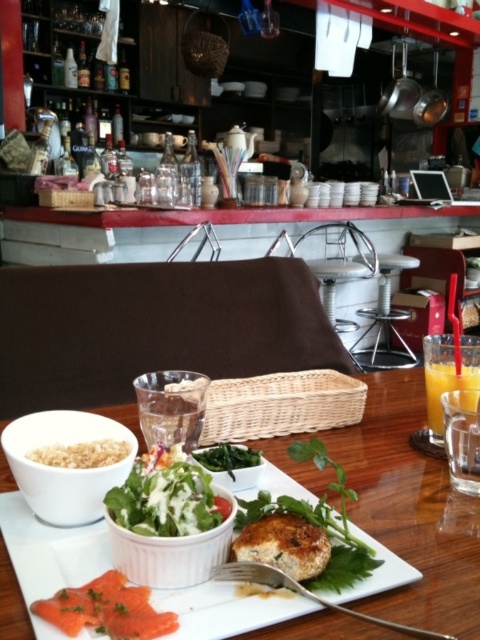
Question: Among these objects, which one is nearest to the camera?

Choices:
 (A) white ceramic plate at center
 (B) translucent glass of orange juice at right
 (C) brown crumbly at lower left

Answer: (A)

Question: Does white matte bowl at lower left appear on the right side of green leafy salad at center?

Choices:
 (A) no
 (B) yes

Answer: (A)

Question: Among these points, which one is farthest from the camera?

Choices:
 (A) (436, 384)
 (B) (444, 570)
 (C) (120, 429)
 (D) (91, 444)

Answer: (A)

Question: Can you confirm if white ceramic bowl at center is positioned to the left of green leafy vegetable at center?

Choices:
 (A) no
 (B) yes

Answer: (B)

Question: Where is white ceramic bowl at center located in relation to translucent glass of orange juice at right in the image?

Choices:
 (A) below
 (B) above

Answer: (A)

Question: Among these objects, which one is farthest from the camera?

Choices:
 (A) green leafy salad at center
 (B) white matte bowl at lower left

Answer: (B)